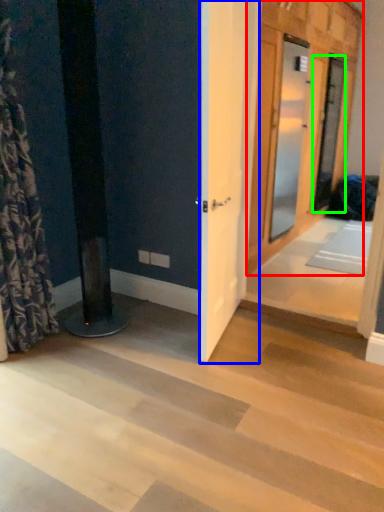
Question: Which is nearer to the door (highlighted by a red box)? barn door (highlighted by a blue box) or door (highlighted by a green box).

Choices:
 (A) barn door
 (B) door

Answer: (B)